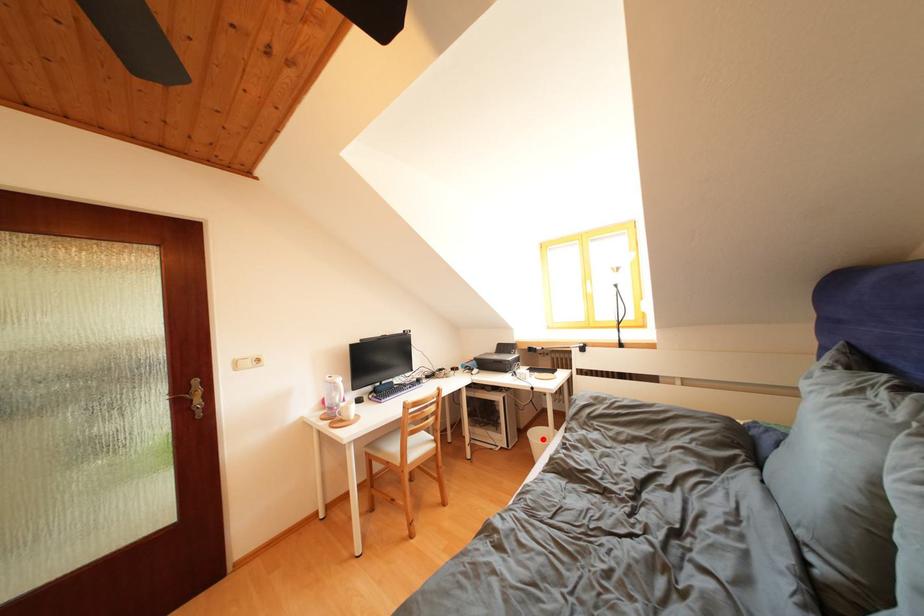
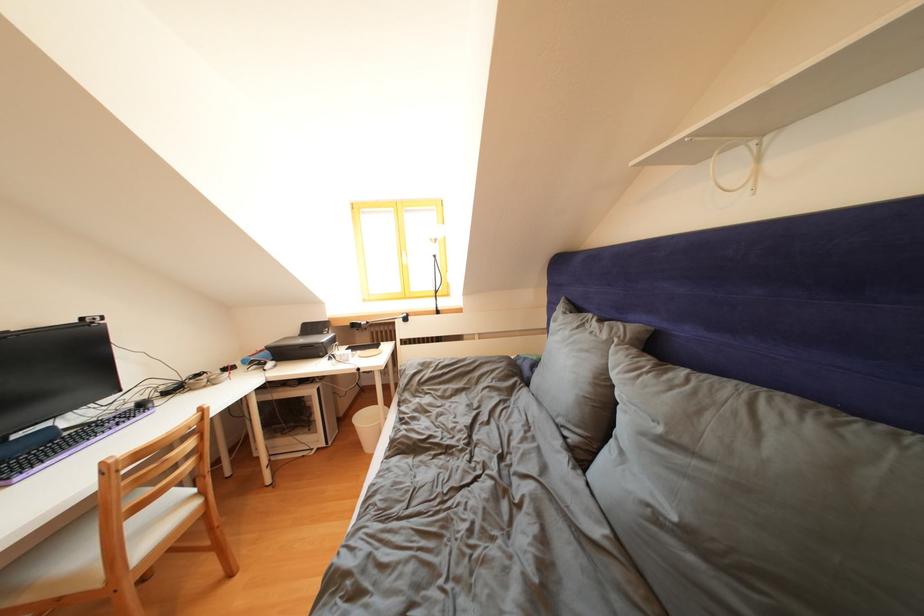
In the second image, find the point that corresponds to the highlighted location in the first image.

(371, 424)